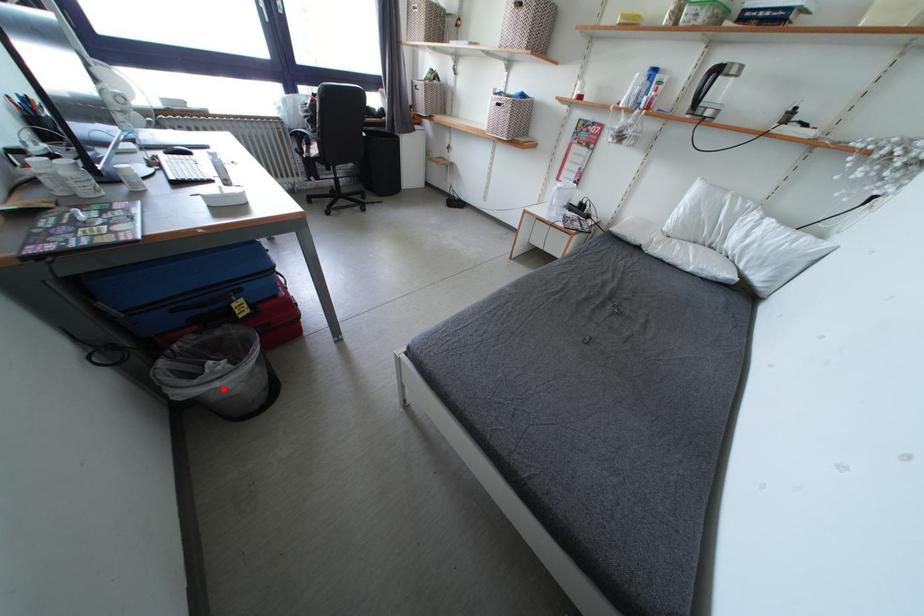
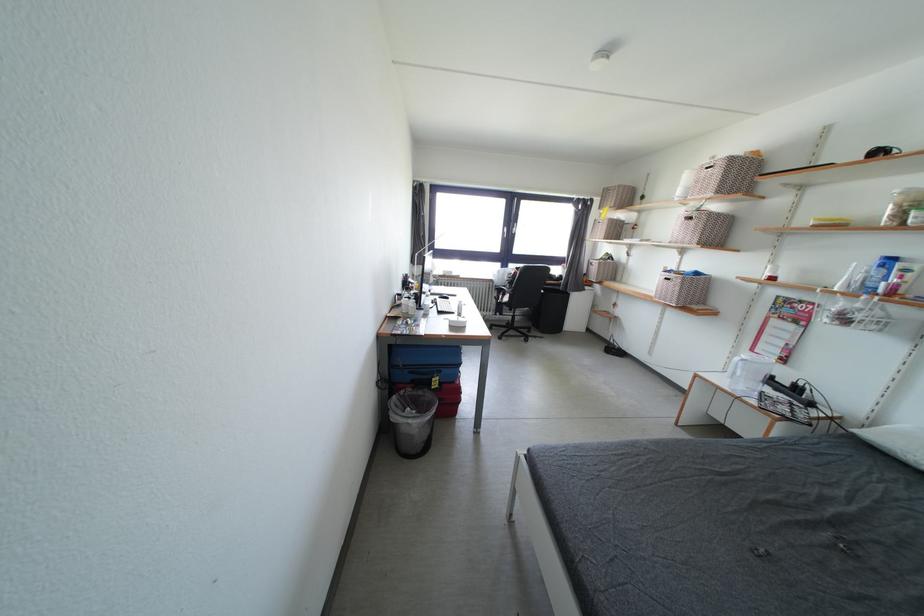
Question: I am providing you with two images of the same scene from different viewpoints. Given a red point in image1, look at the same physical point in image2. Is it:

Choices:
 (A) Closer to the viewpoint
 (B) Farther from the viewpoint

Answer: (B)